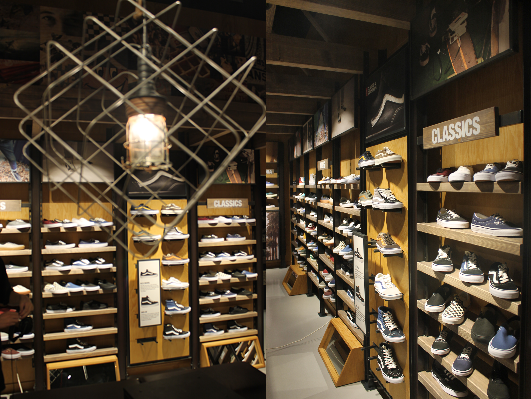
The image size is (531, 399). Find the location of `visible shoe racks`. visible shoe racks is located at coordinates (11, 228), (84, 247), (243, 257), (273, 178), (299, 197), (314, 198), (330, 200), (349, 205), (465, 221).